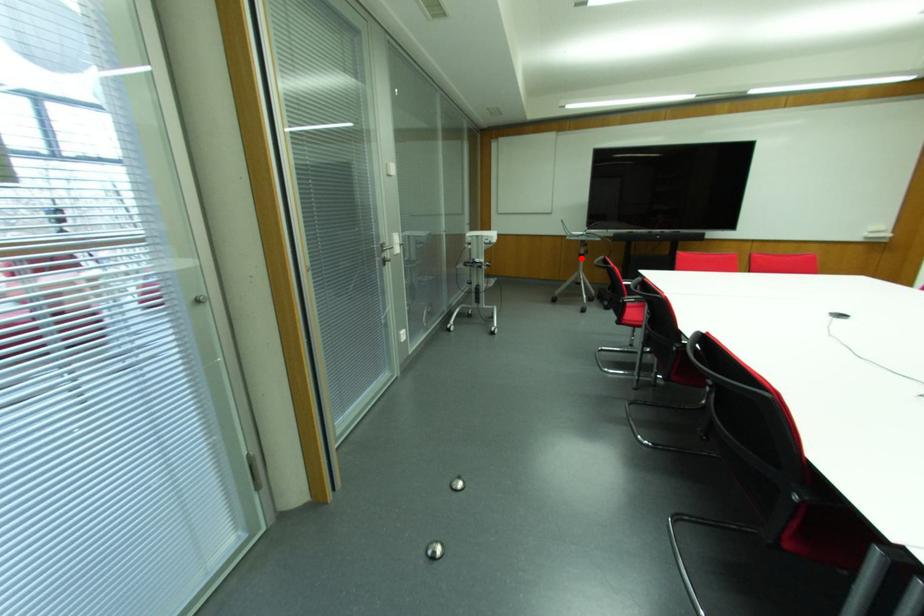
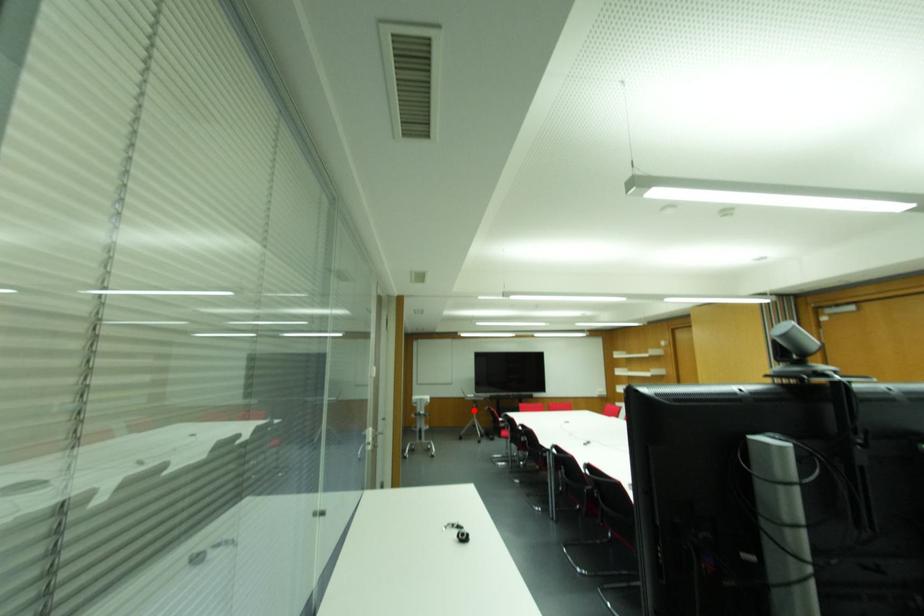
I am providing you with two images of the same scene from different viewpoints. A red point is marked on the first image and another point is marked on the second image. Is the marked point in image1 the same physical position as the marked point in image2?

Yes